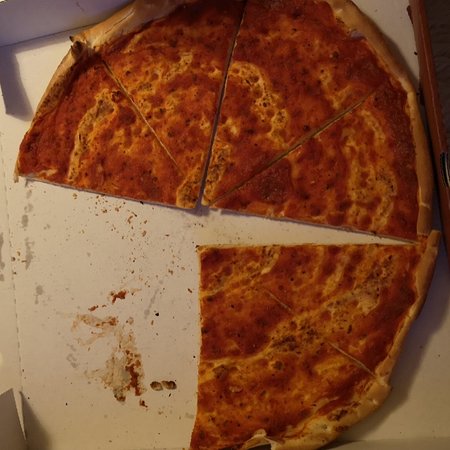
The width and height of the screenshot is (450, 450). Find the location of `grease stain`. grease stain is located at coordinates (116, 373), (94, 324), (29, 255), (39, 290), (25, 220), (28, 205), (29, 194).